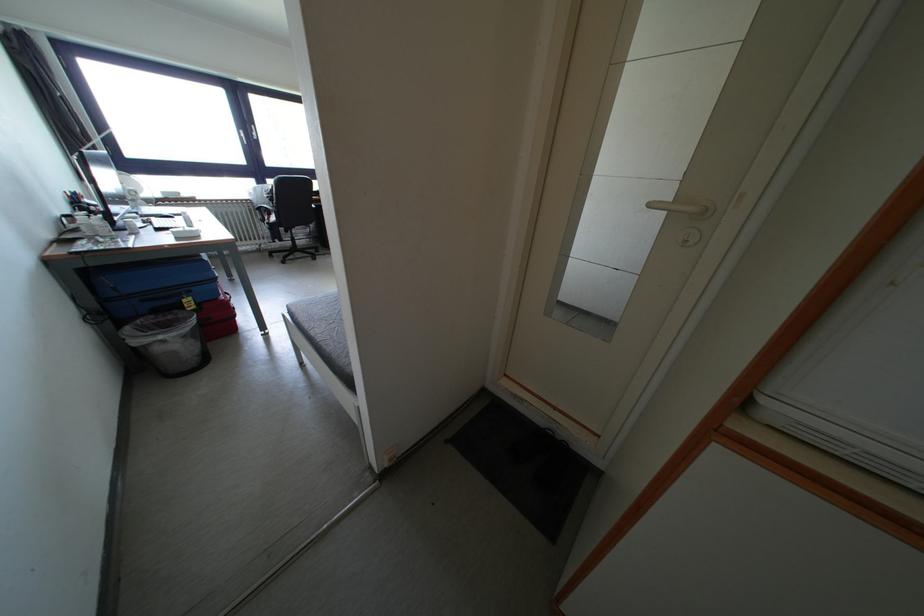
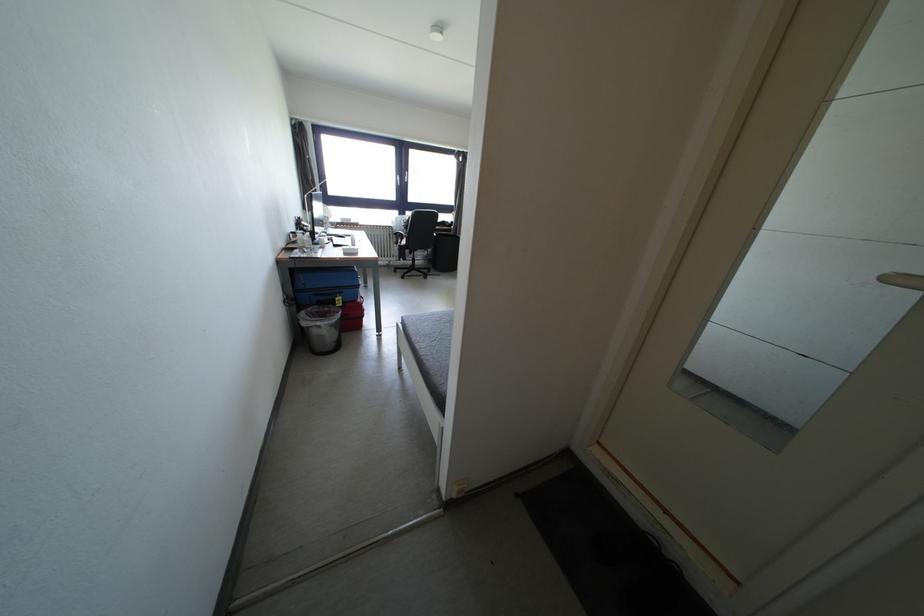
The point at (190, 305) is marked in the first image. Where is the corresponding point in the second image?

(344, 302)